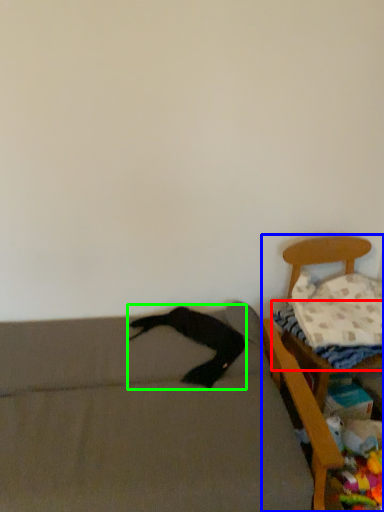
Question: Based on their relative distances, which object is farther from sheet (highlighted by a red box)? Choose from furniture (highlighted by a blue box) and clothing (highlighted by a green box).

Choices:
 (A) furniture
 (B) clothing

Answer: (B)